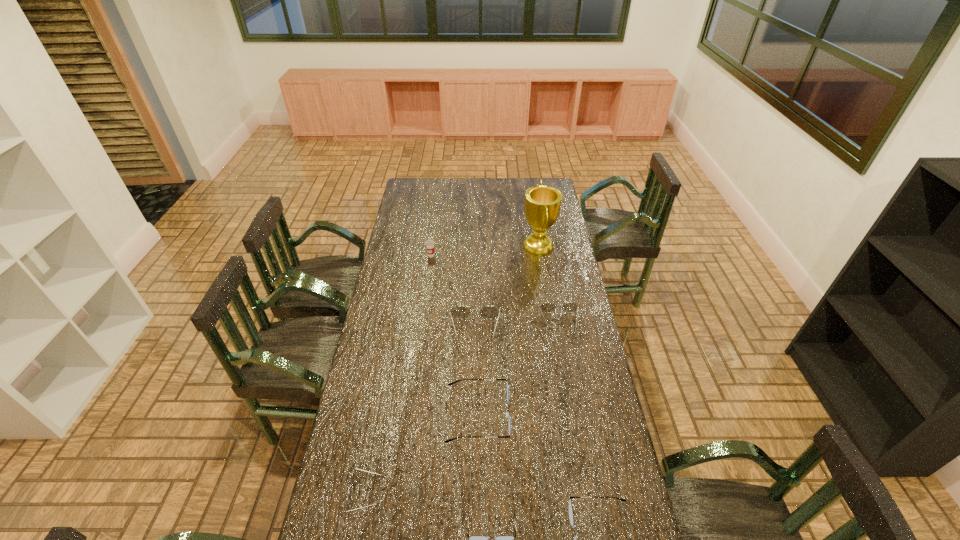
Where is `blank area located 0.180m on the shiny surface of the golden award`? The height and width of the screenshot is (540, 960). blank area located 0.180m on the shiny surface of the golden award is located at coordinates (486, 246).

Where is `vacant space located 0.300m on the shiny surface of the golden award`? This screenshot has width=960, height=540. vacant space located 0.300m on the shiny surface of the golden award is located at coordinates (463, 246).

This screenshot has height=540, width=960. Identify the location of free space located 0.330m on the shiny surface of the golden award. 456,246.

The width and height of the screenshot is (960, 540). What are the coordinates of `vacant region located 0.070m on the side of the second tallest object with the logo` in the screenshot? It's located at (429, 268).

This screenshot has height=540, width=960. Find the location of `free spot located on the front-facing side of the biggest yellow spectacles`. free spot located on the front-facing side of the biggest yellow spectacles is located at coordinates (474, 414).

This screenshot has height=540, width=960. In order to click on free region located on the lenses of the farthest black spectacles in this screenshot , I will do `click(601, 415)`.

Identify the location of vacant space situated on the front-facing side of the second biggest yellow spectacles. The height and width of the screenshot is (540, 960). (569, 377).

The width and height of the screenshot is (960, 540). I want to click on blank space located on the front-facing side of the nearest yellow spectacles, so click(x=464, y=494).

Locate an element on the screen. The height and width of the screenshot is (540, 960). object located at the left edge is located at coordinates (353, 478).

Where is `award present at the right edge`? award present at the right edge is located at coordinates (542, 203).